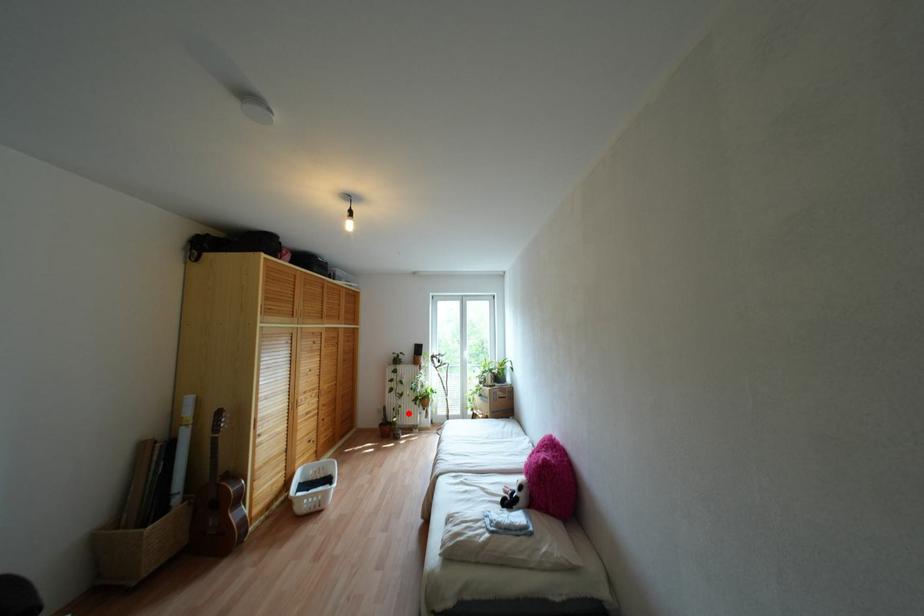
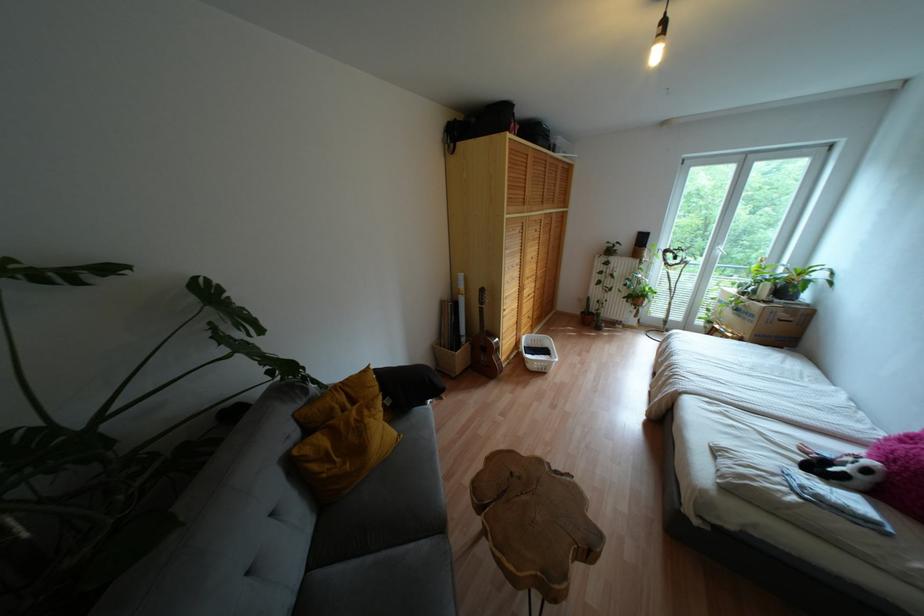
Question: I am providing you with two images of the same scene from different viewpoints. A red point is marked on the first image. At the location where the point appears in image 1, is it still visible in image 2?

Choices:
 (A) Yes
 (B) No

Answer: (A)